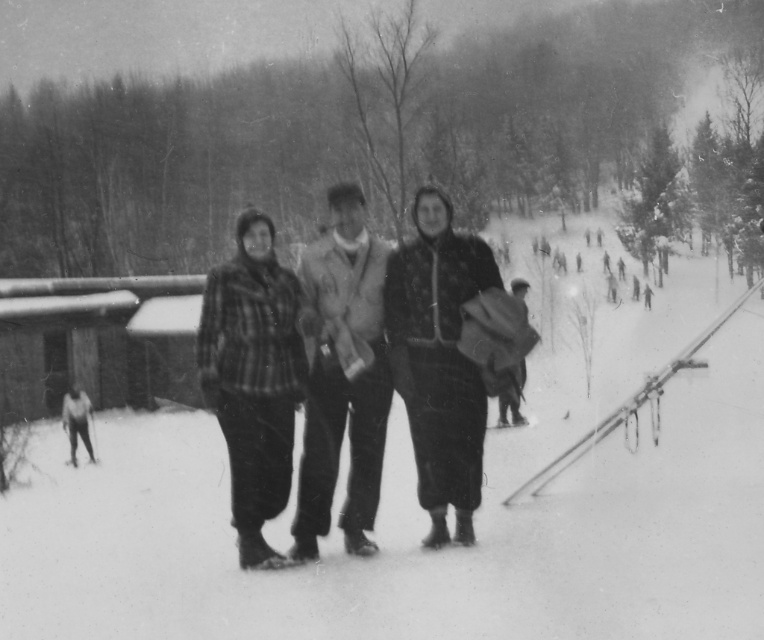
Looking at this image, which is above, white fluffy snow at center or knitted wool sweater at center?

knitted wool sweater at center is higher up.

Looking at this image, can you confirm if white fluffy snow at center is thinner than knitted wool sweater at center?

No.

The height and width of the screenshot is (640, 764). Describe the element at coordinates (423, 513) in the screenshot. I see `white fluffy snow at center` at that location.

Locate an element on the screen. The height and width of the screenshot is (640, 764). white fluffy snow at center is located at coordinates (423, 513).

Looking at this image, does plaid fabric jacket at center appear over knitted wool sweater at center?

No, plaid fabric jacket at center is not above knitted wool sweater at center.

Can you confirm if plaid fabric jacket at center is smaller than knitted wool sweater at center?

Actually, plaid fabric jacket at center might be larger than knitted wool sweater at center.

Which is in front, point (429, 392) or point (325, 339)?

Point (325, 339) is in front.

Identify the location of plaid fabric jacket at center. Image resolution: width=764 pixels, height=640 pixels. (439, 358).

Does white fluffy snow at center have a greater height compared to plaid fabric pants at center?

Correct, white fluffy snow at center is much taller as plaid fabric pants at center.

Is point (711, 349) positioned before point (228, 289)?

No, it is behind (228, 289).

You are a GUI agent. You are given a task and a screenshot of the screen. Output one action in this format:
    pyautogui.click(x=<x>, y=<y>)
    Task: Click on the white fluffy snow at center
    This screenshot has width=764, height=640.
    Given the screenshot: What is the action you would take?
    pyautogui.click(x=423, y=513)